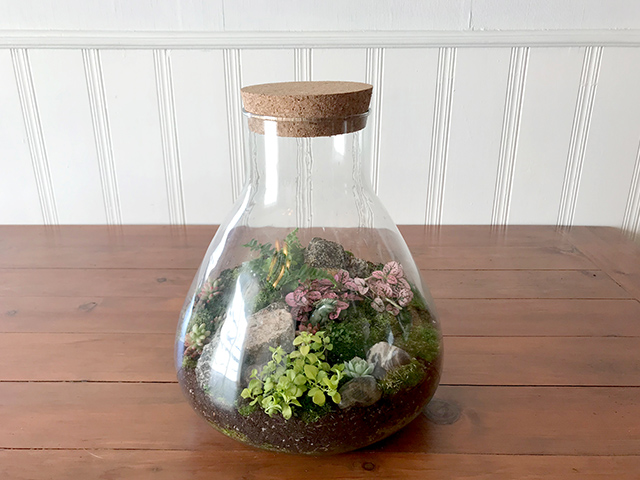
Where is `terrarium`? terrarium is located at coordinates (336, 256).